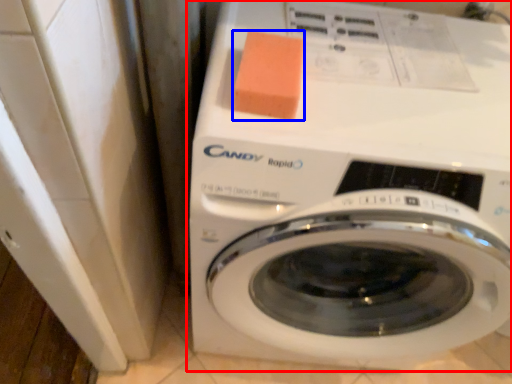
Question: Which object appears farthest to the camera in this image, washing machine (highlighted by a red box) or soap (highlighted by a blue box)?

Choices:
 (A) washing machine
 (B) soap

Answer: (B)